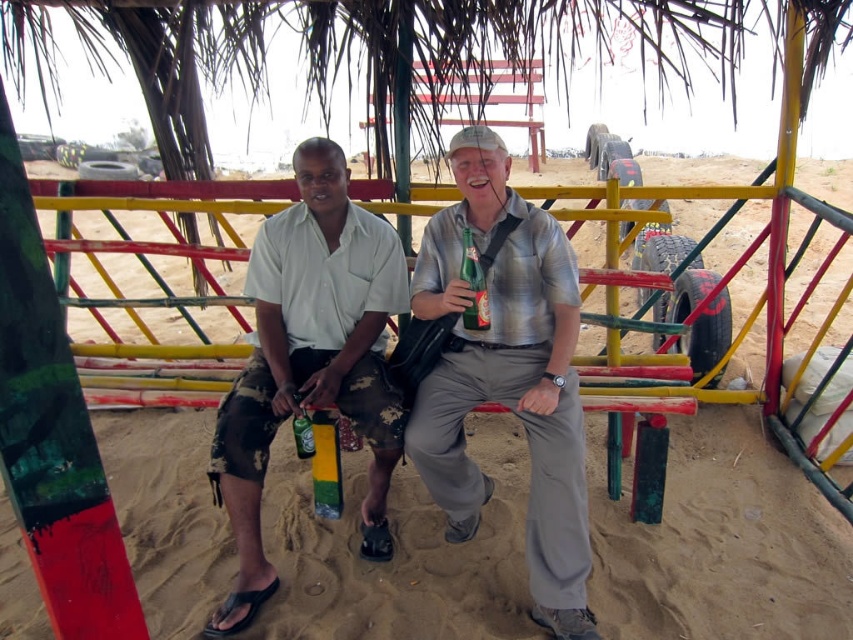
Question: Estimate the real-world distances between objects in this image. Which object is closer to the camouflage shorts at center?

Choices:
 (A) green matte can at lower center
 (B) matte gray shirt at center
 (C) green glass bottle at center

Answer: (A)

Question: Can you confirm if camouflage shorts at center is positioned below green glass bottle at center?

Choices:
 (A) yes
 (B) no

Answer: (A)

Question: Which object is positioned farthest from the green matte can at lower center?

Choices:
 (A) camouflage shorts at center
 (B) matte gray shirt at center

Answer: (B)

Question: Which of these objects is positioned closest to the matte gray shirt at center?

Choices:
 (A) green glass bottle at center
 (B) green matte can at lower center
 (C) camouflage shorts at center

Answer: (A)

Question: Can you confirm if matte gray shirt at center is thinner than camouflage shorts at center?

Choices:
 (A) no
 (B) yes

Answer: (B)

Question: Does matte gray shirt at center have a lesser width compared to green matte can at lower center?

Choices:
 (A) yes
 (B) no

Answer: (B)